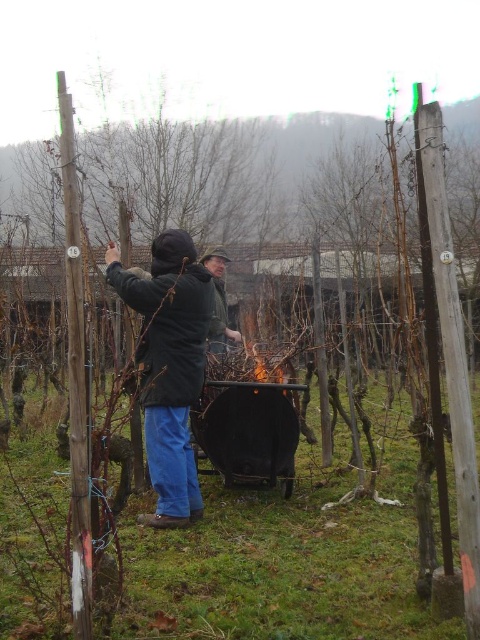
Is point (115, 278) positioned in front of point (237, 339)?

Yes, point (115, 278) is closer to viewer.

Which of these two, dark blue jacket at center or green matte jacket at center, stands taller?

With more height is dark blue jacket at center.

Describe the element at coordinates (168, 365) in the screenshot. I see `dark blue jacket at center` at that location.

This screenshot has width=480, height=640. Identify the location of dark blue jacket at center. (168, 365).